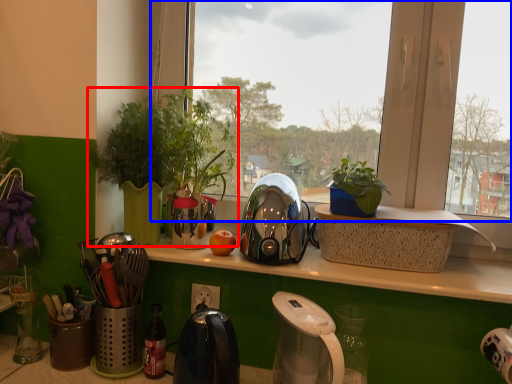
Question: Among these objects, which one is nearest to the camera, houseplant (highlighted by a red box) or window (highlighted by a blue box)?

Choices:
 (A) houseplant
 (B) window

Answer: (B)